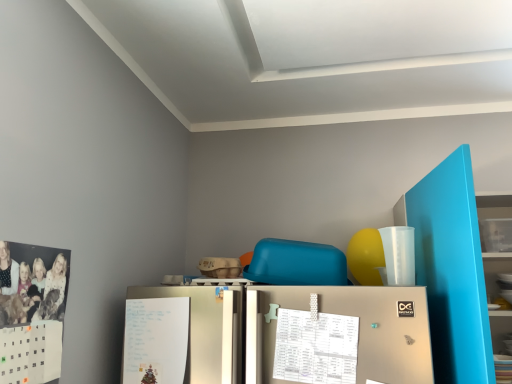
Question: In the image, is matte blue bookshelf at right positioned in front of or behind white paper at lower left?

Choices:
 (A) front
 (B) behind

Answer: (A)

Question: Looking at the image, does matte blue bookshelf at right seem bigger or smaller compared to white paper at lower left?

Choices:
 (A) small
 (B) big

Answer: (B)

Question: Which is farther from the white paper at lower left?

Choices:
 (A) white paper calendar at center
 (B) matte blue bookshelf at right

Answer: (B)

Question: Which object is positioned closest to the white paper at lower left?

Choices:
 (A) white paper calendar at center
 (B) matte blue bookshelf at right

Answer: (A)